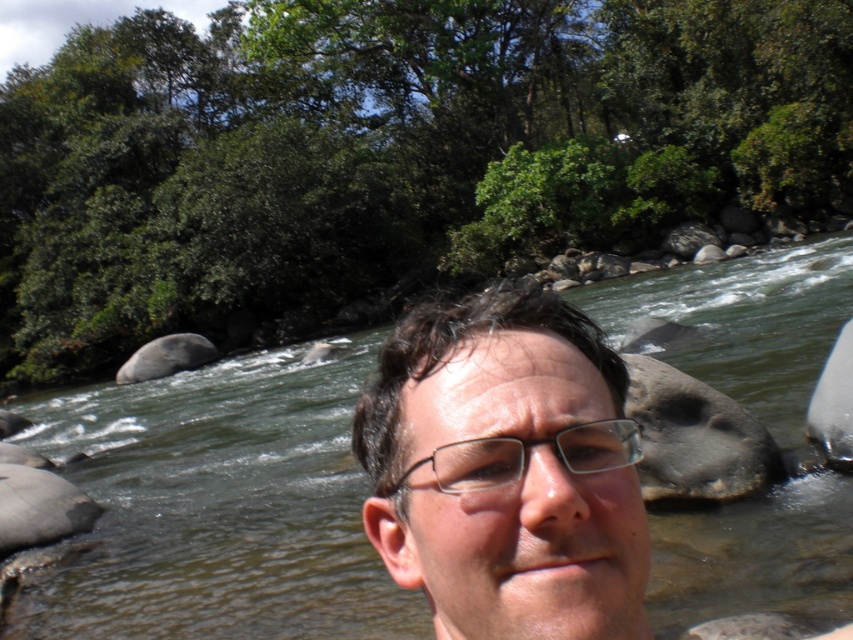
In the scene shown: Is green smooth water at center smaller than matte skin face at center?

Incorrect, green smooth water at center is not smaller in size than matte skin face at center.

Does green smooth water at center have a lesser width compared to matte skin face at center?

In fact, green smooth water at center might be wider than matte skin face at center.

What do you see at coordinates (218, 506) in the screenshot? I see `green smooth water at center` at bounding box center [218, 506].

Find the location of a particular element. green smooth water at center is located at coordinates (218, 506).

Is green smooth water at center to the right of clear plastic glasses at center from the viewer's perspective?

No, green smooth water at center is not to the right of clear plastic glasses at center.

Who is more distant from viewer, (x=703, y=304) or (x=466, y=458)?

Positioned behind is point (x=703, y=304).

You are a GUI agent. You are given a task and a screenshot of the screen. Output one action in this format:
    pyautogui.click(x=<x>, y=<y>)
    Task: Click on the green smooth water at center
    This screenshot has height=640, width=853.
    Given the screenshot: What is the action you would take?
    pyautogui.click(x=218, y=506)

I want to click on green smooth water at center, so click(218, 506).

Is point (409, 346) more distant than point (573, 428)?

Yes.

Who is more forward, (x=614, y=502) or (x=437, y=486)?

Positioned in front is point (x=614, y=502).

Who is more distant from viewer, (547,582) or (578,449)?

The point (578,449) is behind.

Image resolution: width=853 pixels, height=640 pixels. I want to click on matte skin face at center, so pyautogui.click(x=503, y=470).